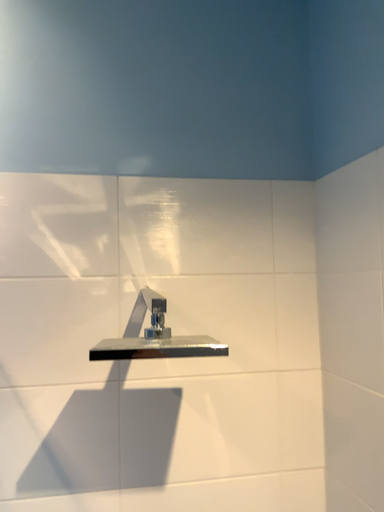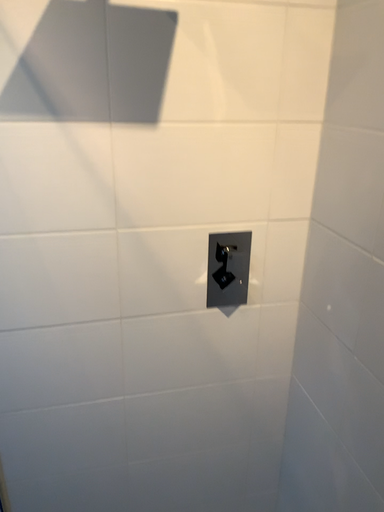
Question: How did the camera likely rotate when shooting the video?

Choices:
 (A) rotated upward
 (B) rotated downward

Answer: (B)